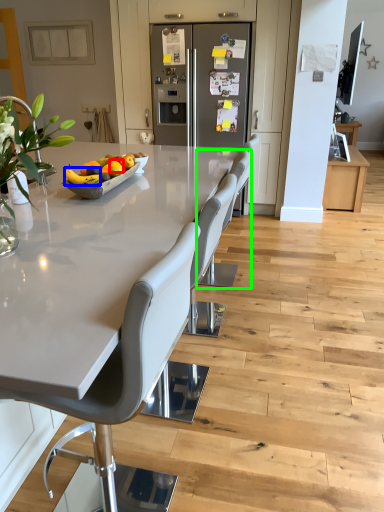
Question: Based on their relative distances, which object is nearer to orange (highlighted by a red box)? Choose from fruit (highlighted by a blue box) and chair (highlighted by a green box).

Choices:
 (A) fruit
 (B) chair

Answer: (A)